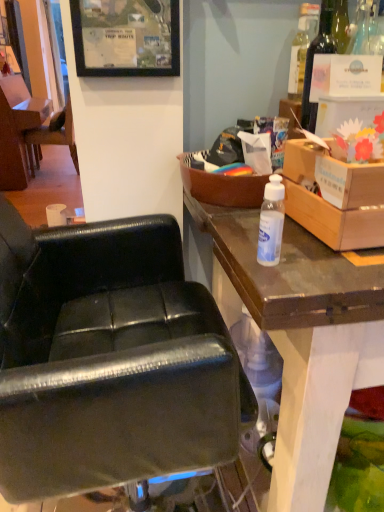
Question: Considering the positions of point (3, 201) and point (334, 201), is point (3, 201) closer or farther from the camera than point (334, 201)?

Choices:
 (A) closer
 (B) farther

Answer: (B)

Question: Is black leather chair at center, positioned as the 1th chair in front-to-back order, to the left or to the right of cardboard box at upper right, the first box positioned from the right, in the image?

Choices:
 (A) left
 (B) right

Answer: (A)

Question: Considering the real-world distances, which object is farthest from the black leather chair at left, which is counted as the 1th chair, starting from the back?

Choices:
 (A) cardboard box at upper right, the second box from the left
 (B) black leather chair at center, positioned as the 1th chair in front-to-back order
 (C) black matte picture frame at upper center
 (D) transparent plastic bottle at center, which ranks as the 1th bottle in left-to-right order
 (E) brown wooden box at upper right, which is the 2th box in right-to-left order

Answer: (D)

Question: Which of these objects is positioned farthest from the black matte picture frame at upper center?

Choices:
 (A) brown wooden box at upper right, which is the first box in left-to-right order
 (B) black leather chair at left, which appears as the first chair when viewed from the left
 (C) transparent plastic bottle at center, which ranks as the 1th bottle in left-to-right order
 (D) translucent plastic bottle at upper right, acting as the 2th bottle starting from the front
 (E) black leather chair at center, the second chair when ordered from top to bottom

Answer: (B)